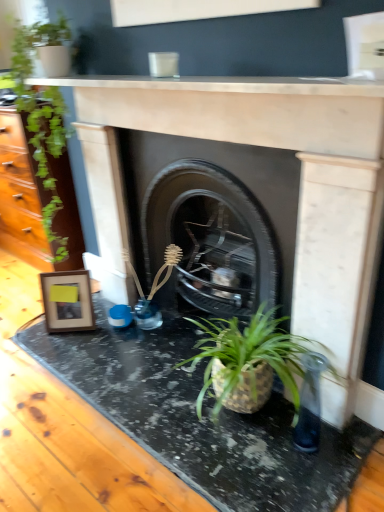
Question: Is green leafy plant at left inside or outside of wooden photo frame at left?

Choices:
 (A) inside
 (B) outside

Answer: (B)

Question: Considering the positions of green leafy plant at left and wooden photo frame at left in the image, is green leafy plant at left bigger or smaller than wooden photo frame at left?

Choices:
 (A) small
 (B) big

Answer: (B)

Question: Which object is the farthest from the black marble counter top at lower center, which is the second counter top from top to bottom?

Choices:
 (A) green leafy plant at left
 (B) wooden photo frame at left
 (C) black marble fireplace at center, the 2th fireplace from the front
 (D) matte stone fireplace at center, the second fireplace positioned from the back
 (E) white marble fireplace at upper center, which is counted as the 2th counter top, starting from the bottom

Answer: (E)

Question: Estimate the real-world distances between objects in this image. Which object is farther from the matte stone fireplace at center, which ranks as the first fireplace in front-to-back order?

Choices:
 (A) black marble fireplace at center, placed as the first fireplace when sorted from back to front
 (B) green leafy plant at left
 (C) black marble counter top at lower center, which is the second counter top from top to bottom
 (D) wooden photo frame at left
 (E) white marble fireplace at upper center, which is counted as the 2th counter top, starting from the bottom

Answer: (B)